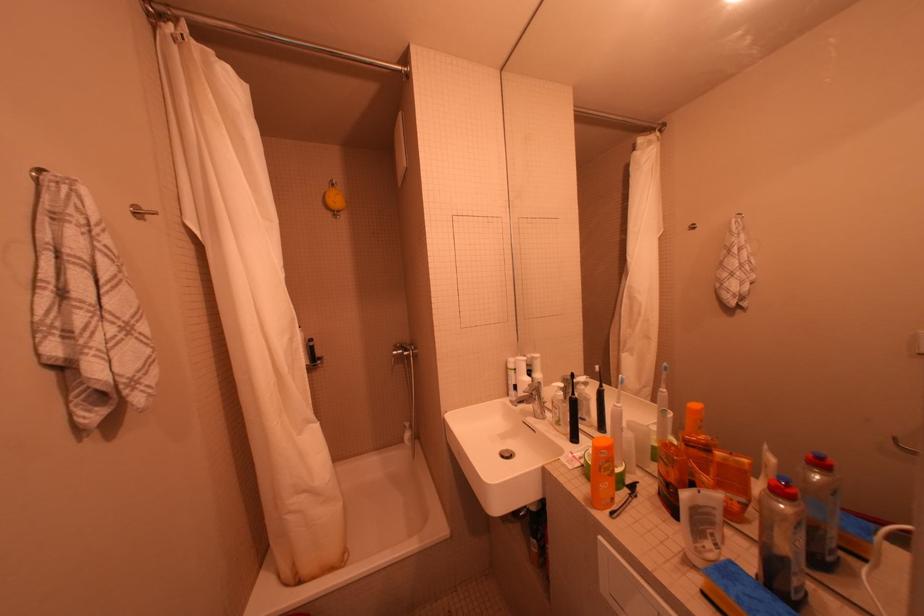
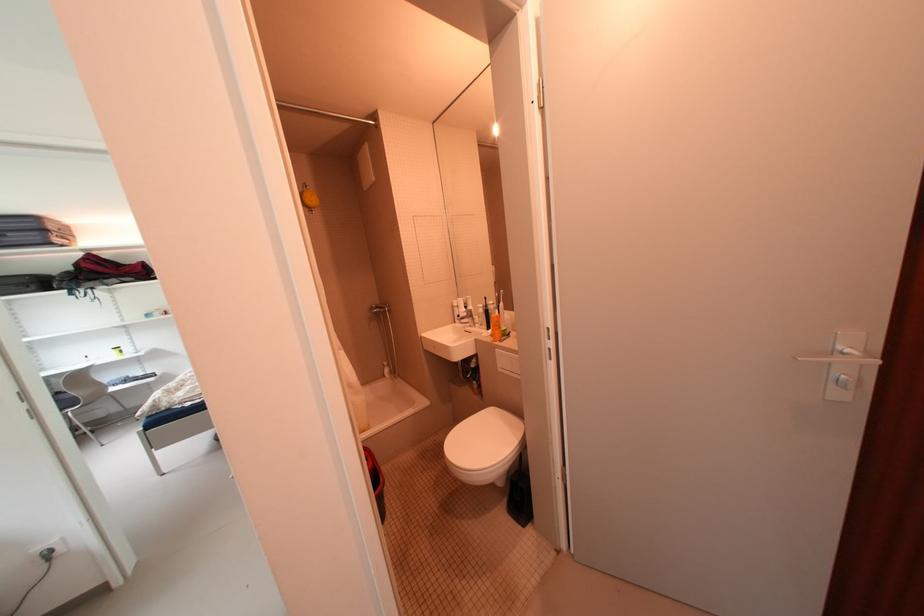
Where in the second image is the point corresponding to point (516, 370) from the first image?

(460, 308)